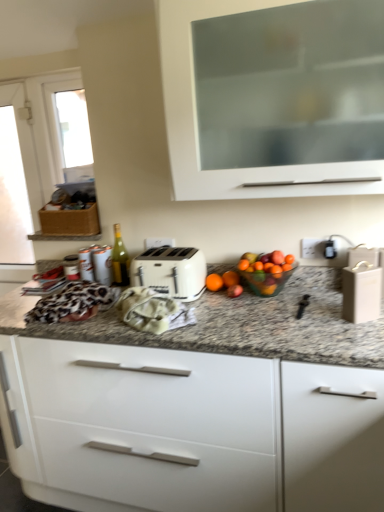
Question: In terms of height, does orange matte at center look taller or shorter compared to leopard print fabric at center?

Choices:
 (A) tall
 (B) short

Answer: (B)

Question: From a real-world perspective, relative to leopard print fabric at center, is orange matte at center vertically above or below?

Choices:
 (A) above
 (B) below

Answer: (B)

Question: Estimate the real-world distances between objects in this image. Which object is closer to the orange matte at center?

Choices:
 (A) metallic silver canister at left, which appears as the 2th appliance when viewed from the right
 (B) white matte cabinet at upper center, which appears as the 2th cabinetry when ordered from the bottom
 (C) white glossy cabinet at center, which is counted as the second cabinetry, starting from the top
 (D) white plastic toaster at center
 (E) white plastic electric outlet at upper right, which is counted as the first electric outlet, starting from the right

Answer: (D)

Question: Estimate the real-world distances between objects in this image. Which object is closer to the green glass bottle at center?

Choices:
 (A) white plastic electric outlet at center, arranged as the first electric outlet when viewed from the back
 (B) white plastic toaster at center
 (C) white glossy cabinet at center, which is counted as the second cabinetry, starting from the top
 (D) metallic silver canister at left, arranged as the 2th appliance when viewed from the front
 (E) white matte cabinet at upper center, the 1th cabinetry viewed from the top

Answer: (D)